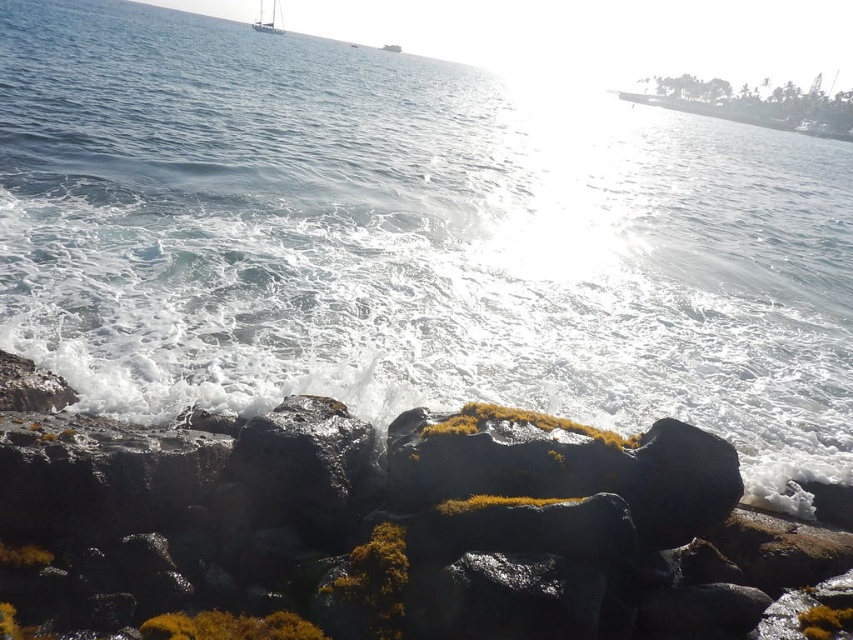
Question: Is rough volcanic rock at lower center behind white glossy sailboat at upper center?

Choices:
 (A) yes
 (B) no

Answer: (B)

Question: Can you confirm if rough volcanic rock at lower center is thinner than white glossy sailboat at upper center?

Choices:
 (A) yes
 (B) no

Answer: (A)

Question: Can you confirm if rough volcanic rock at lower center is wider than white glossy sailboat at upper center?

Choices:
 (A) no
 (B) yes

Answer: (A)

Question: Which object appears closest to the camera in this image?

Choices:
 (A) white glossy sailboat at upper center
 (B) rough volcanic rock at lower center

Answer: (B)